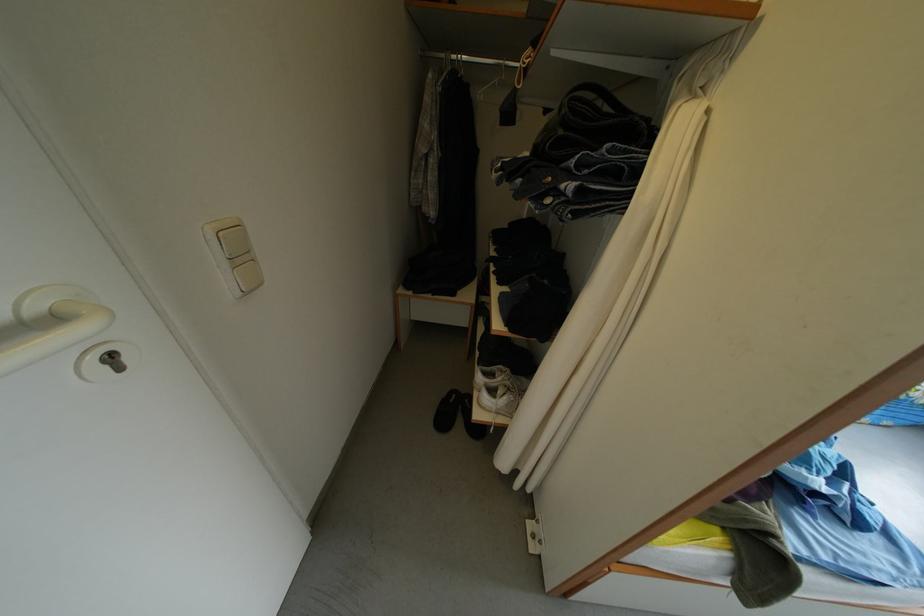
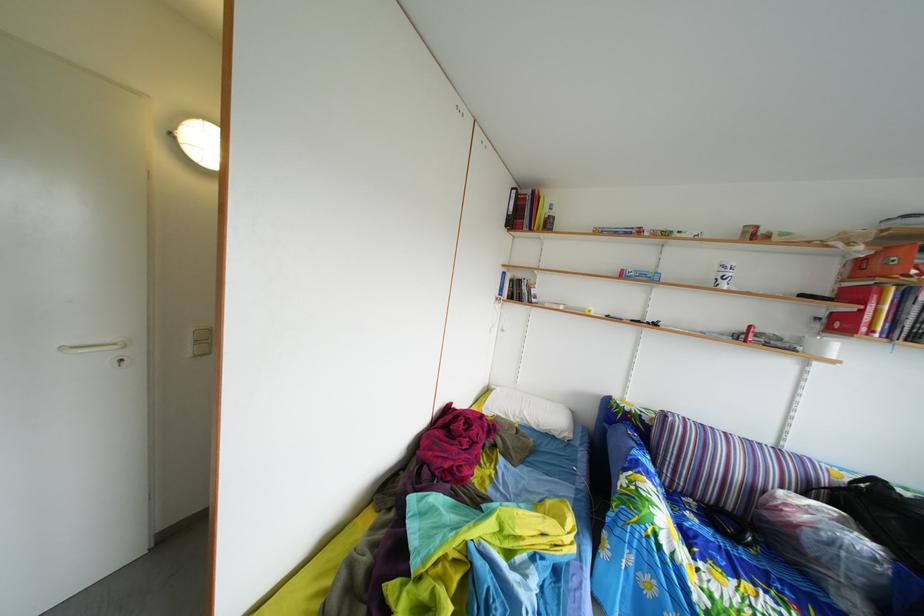
Question: I am providing you with two images of the same scene from different viewpoints. Which of the following objects are not visible in image2?

Choices:
 (A) red stapler
 (B) light switch
 (C) screen pull cord
 (D) white curtain

Answer: (D)